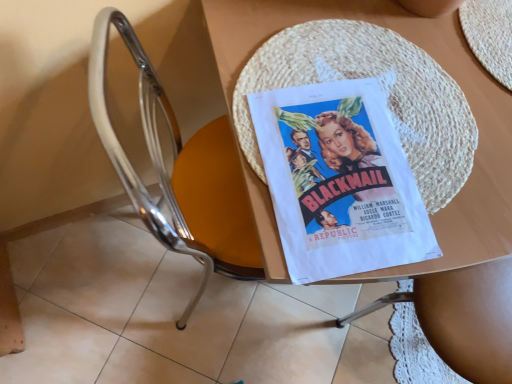
Locate an element on the screen. vacant region to the left of metallic chrome chair at center is located at coordinates (100, 266).